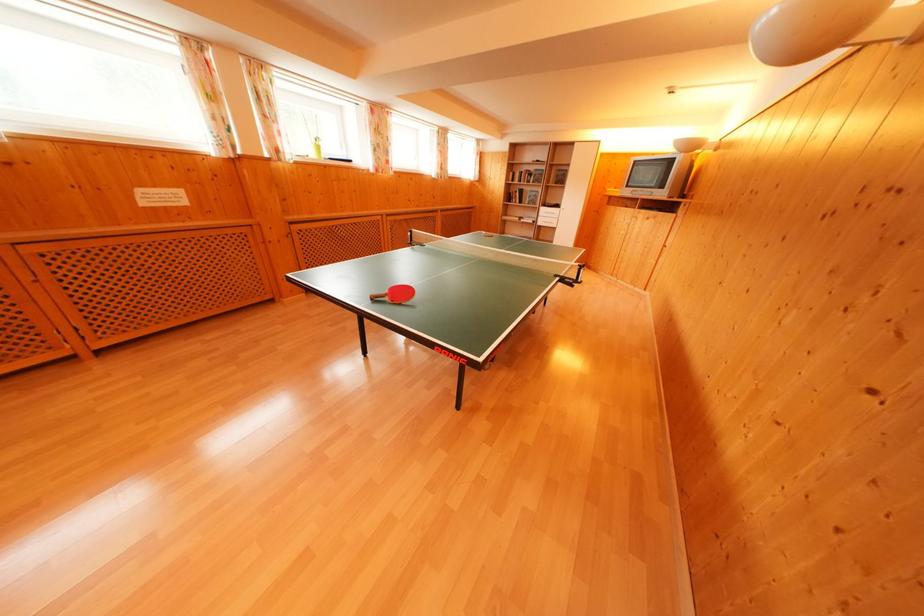
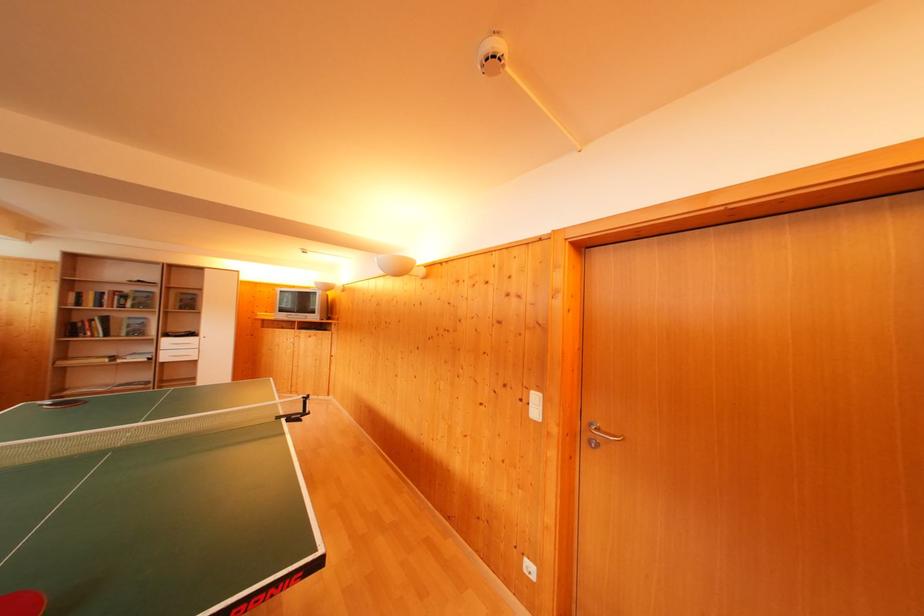
In the second image, find the point that corresponds to (537,174) in the first image.

(131, 294)